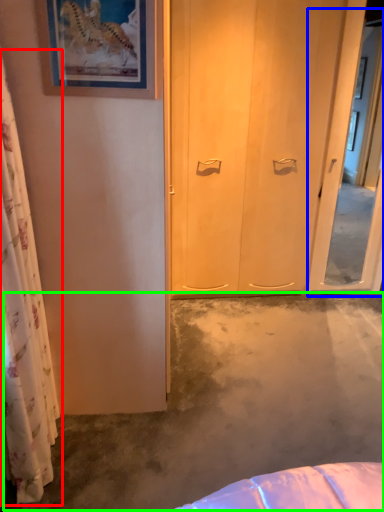
Question: Based on their relative distances, which object is farther from curtain (highlighted by a red box)? Choose from screen door (highlighted by a blue box) and concrete (highlighted by a green box).

Choices:
 (A) screen door
 (B) concrete

Answer: (A)